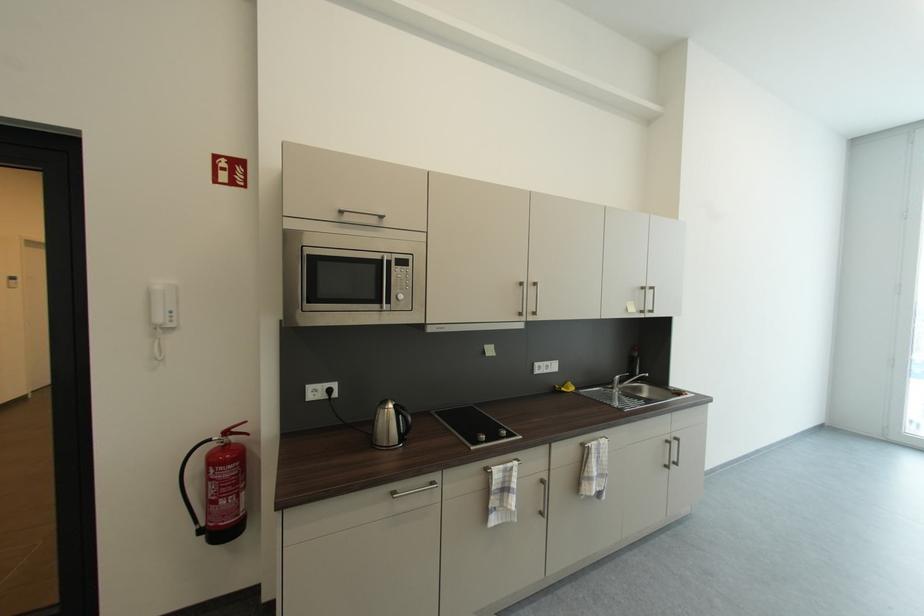
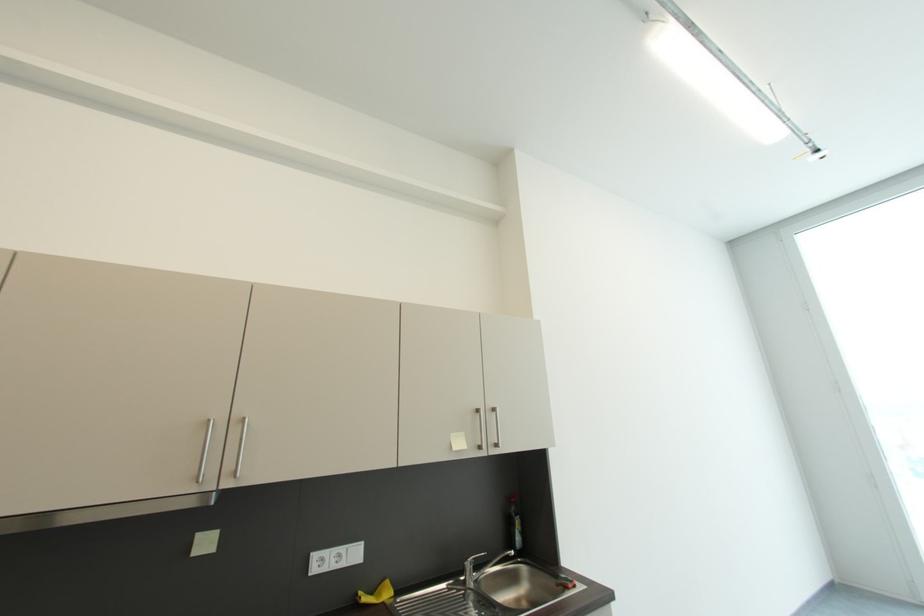
What movement of the cameraman would produce the second image?

The cameraman moved toward right, forward.